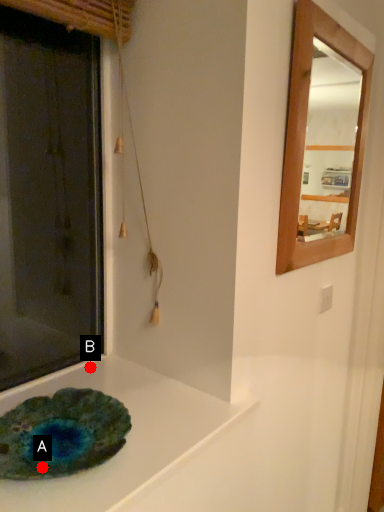
Question: Two points are circled on the image, labeled by A and B beside each circle. Which point is closer to the camera taking this photo?

Choices:
 (A) A is closer
 (B) B is closer

Answer: (A)